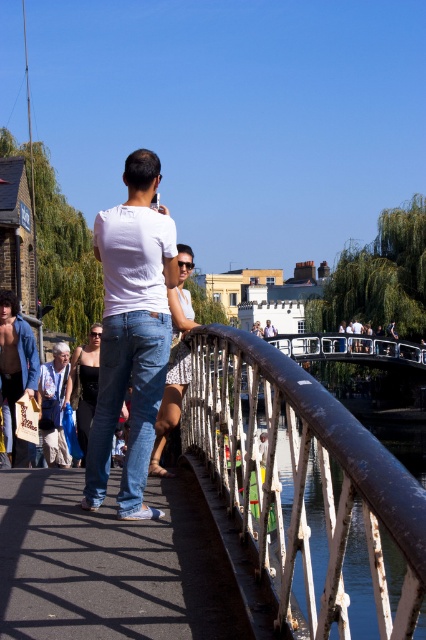
Question: Which point appears farthest from the camera in this image?

Choices:
 (A) click(46, 401)
 (B) click(92, 406)

Answer: (A)

Question: Which of the following is the farthest from the observer?

Choices:
 (A) black denim jeans at center
 (B) denim jeans at lower left

Answer: (A)

Question: Does rusty metal railing at center appear over white matte shirt at center?

Choices:
 (A) yes
 (B) no

Answer: (B)

Question: Which point is farther to the camera?

Choices:
 (A) white printed tank top at center
 (B) white t-shirt at center
 (C) white cotton shirt at upper center

Answer: (B)

Question: Is denim jeans at lower left to the left of black denim jeans at center from the viewer's perspective?

Choices:
 (A) no
 (B) yes

Answer: (B)

Question: Is white matte shirt at center in front of white printed tank top at center?

Choices:
 (A) no
 (B) yes

Answer: (B)